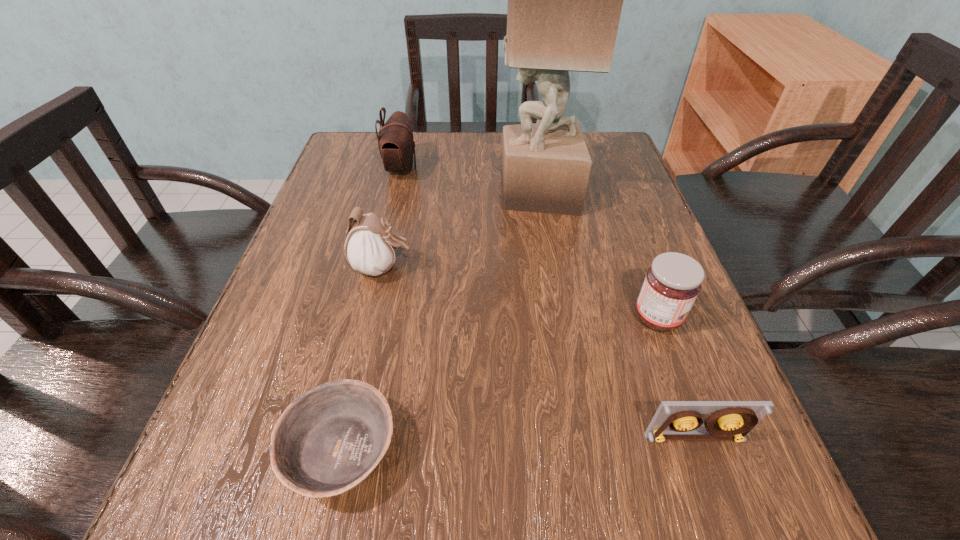
Locate an element on the screen. The width and height of the screenshot is (960, 540). jam that is at the right edge is located at coordinates (672, 283).

Where is `videotape that is at the right edge`? videotape that is at the right edge is located at coordinates (730, 420).

This screenshot has width=960, height=540. What are the coordinates of `object present at the far left corner` in the screenshot? It's located at (396, 144).

Where is `object positioned at the near left corner`? The height and width of the screenshot is (540, 960). object positioned at the near left corner is located at coordinates (329, 440).

Find the location of a particular element. object positioned at the far right corner is located at coordinates (565, 0).

The height and width of the screenshot is (540, 960). In the image, there is a desktop. Identify the location of vacant area at the far edge. (428, 169).

The height and width of the screenshot is (540, 960). In the image, there is a desktop. Find the location of `vacant space at the near edge`. vacant space at the near edge is located at coordinates (630, 479).

At what (x,y) coordinates should I click in order to perform the action: click on vacant space at the left edge of the desktop. Please return your answer as a coordinate pair (x, y). Looking at the image, I should click on (284, 339).

Find the location of a particular element. The height and width of the screenshot is (540, 960). vacant region at the right edge of the desktop is located at coordinates (729, 456).

You are a GUI agent. You are given a task and a screenshot of the screen. Output one action in this format:
    pyautogui.click(x=<x>, y=<y>)
    Task: Click on the vacant position at the far right corner of the desktop
    The height and width of the screenshot is (540, 960).
    Given the screenshot: What is the action you would take?
    pyautogui.click(x=612, y=131)